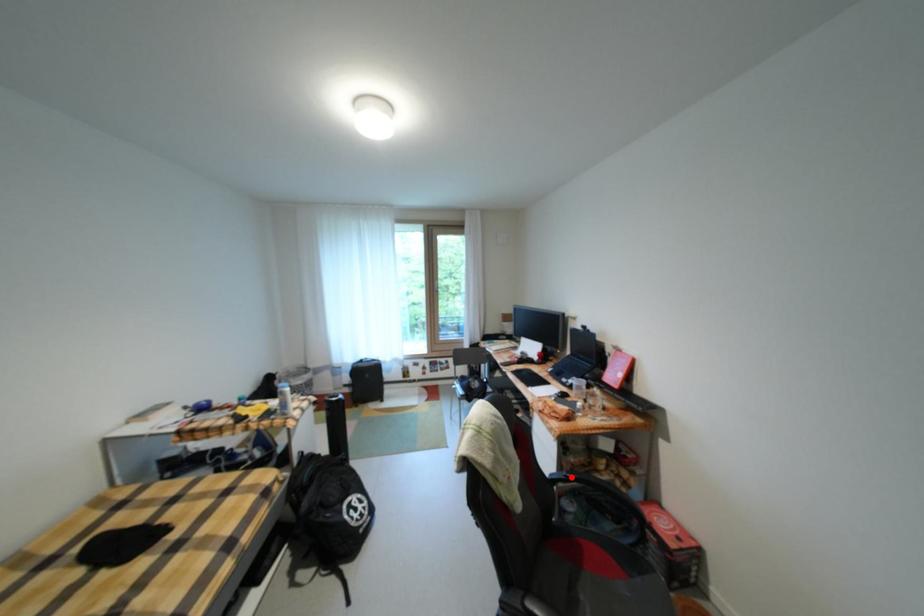
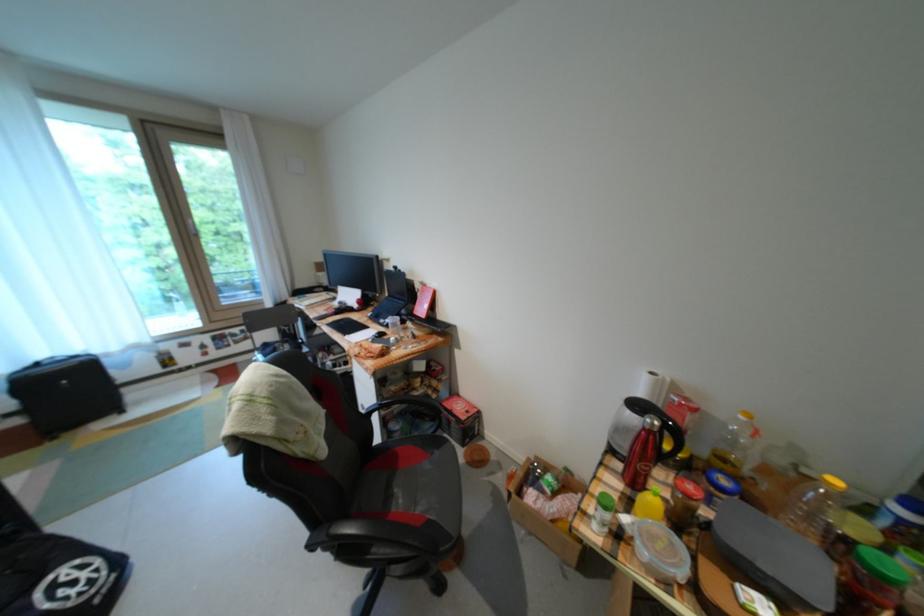
Question: I am providing you with two images of the same scene from different viewpoints. Image1 has a red point marked. In image2, the corresponding 3D location appears at what relative position? Reply with the corresponding letter.

Choices:
 (A) Closer
 (B) Farther

Answer: (A)